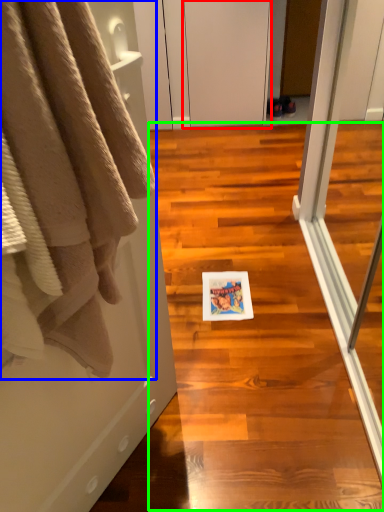
Question: Which object is positioned closest to screen door (highlighted by a red box)? Select from towel (highlighted by a blue box) and stair (highlighted by a green box).

Choices:
 (A) towel
 (B) stair

Answer: (B)